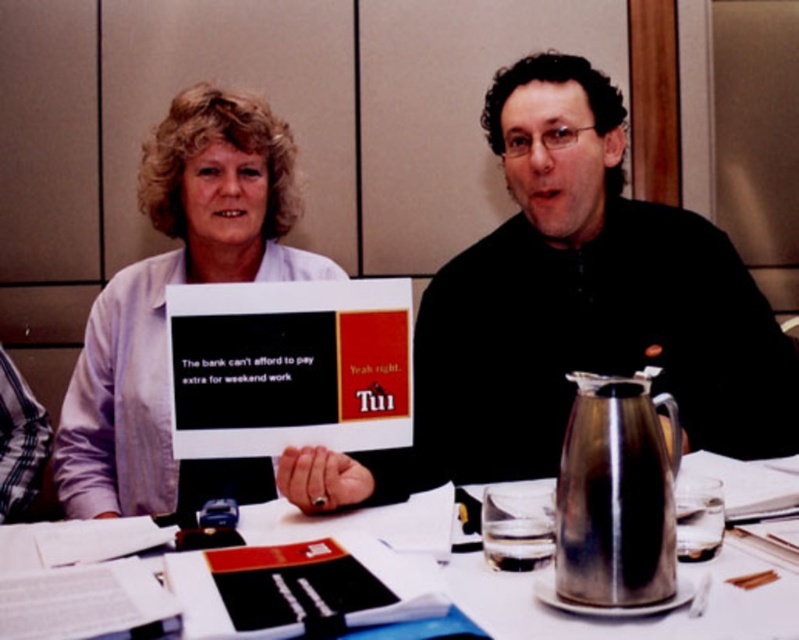
You are standing in front of the table in the conference room. There are two points marked on the table surface. One is at coordinates point (x=476, y=440) and the other is at point (x=74, y=435). Which point is closer to you?

Point (x=476, y=440) is closer to the viewer than point (x=74, y=435).